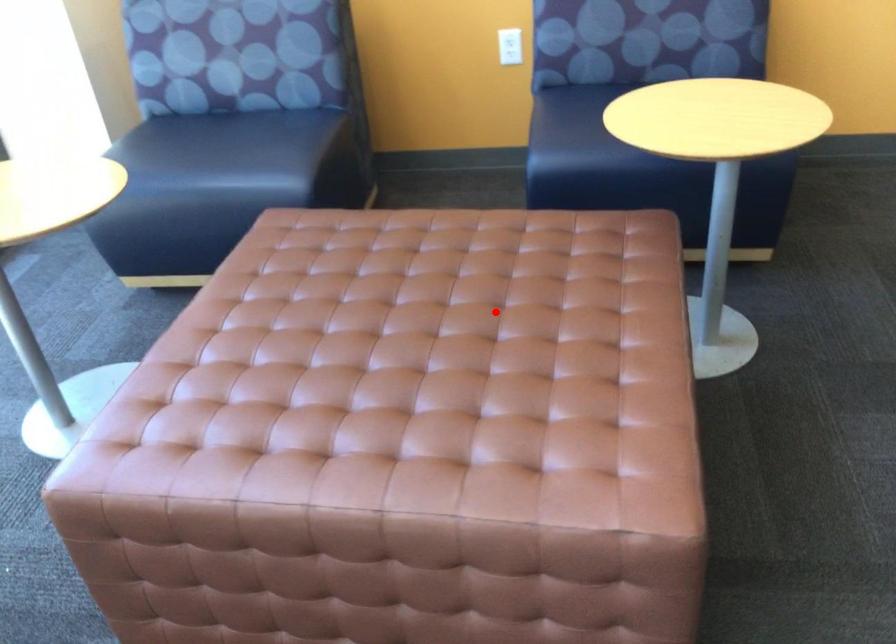
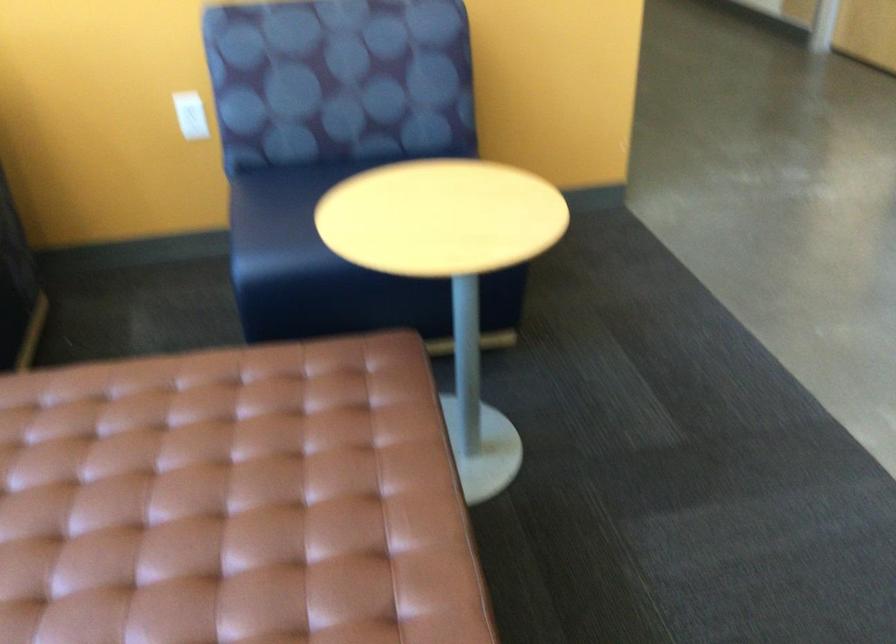
The point at the highlighted location is marked in the first image. Where is the corresponding point in the second image?

(231, 502)